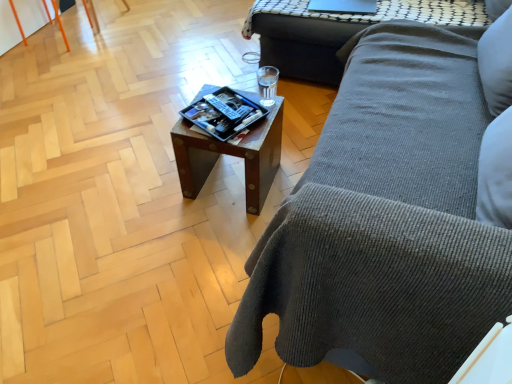
The width and height of the screenshot is (512, 384). Identify the location of free spot below orange plastic chair at upper left (from a real-world perspective). (69, 41).